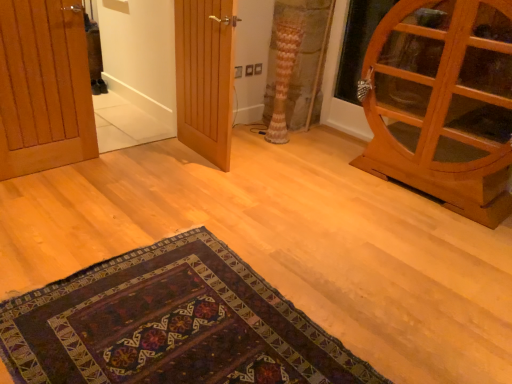
Where is `free space above wooden door at left, placed as the third door when sorted from right to left (from a real-world perspective)`? This screenshot has width=512, height=384. free space above wooden door at left, placed as the third door when sorted from right to left (from a real-world perspective) is located at coordinates (37, 0).